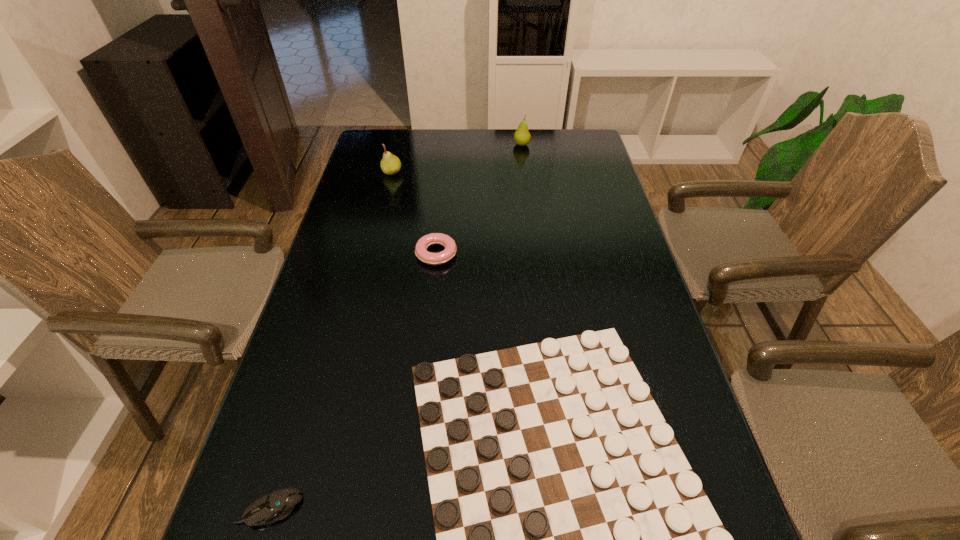
Find the location of a particular element. The width and height of the screenshot is (960, 540). vacant area that lies between the farthest object and the computer mouse is located at coordinates (396, 327).

This screenshot has width=960, height=540. What are the coordinates of `free space between the left pear and the farthest object` in the screenshot? It's located at (457, 158).

The width and height of the screenshot is (960, 540). I want to click on object that is the nearest to the left pear, so click(448, 253).

Image resolution: width=960 pixels, height=540 pixels. I want to click on object that is the second nearest to the computer mouse, so click(448, 253).

Identify the location of free spot that satisfies the following two spatial constraints: 1. on the back side of the computer mouse; 2. on the left side of the farthest object. The width and height of the screenshot is (960, 540). (381, 145).